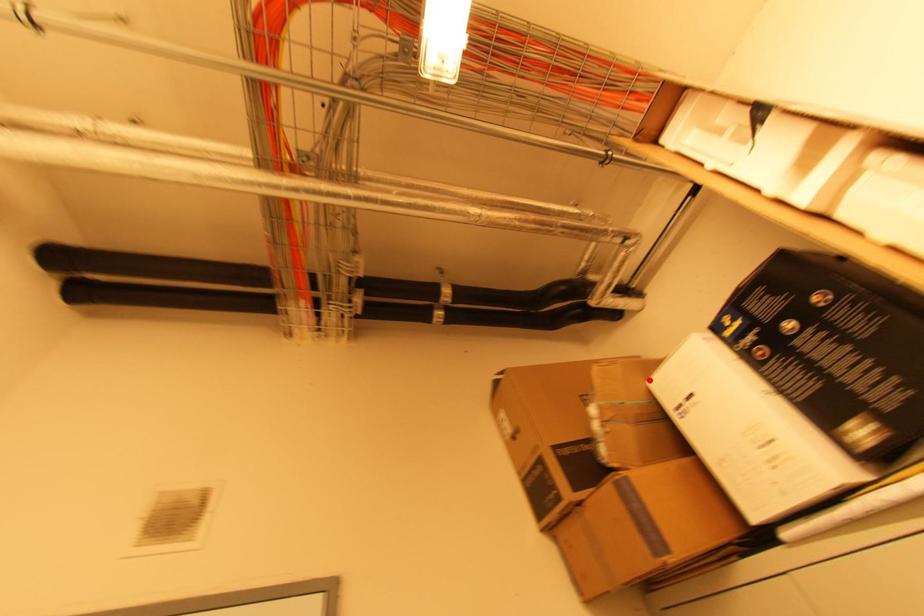
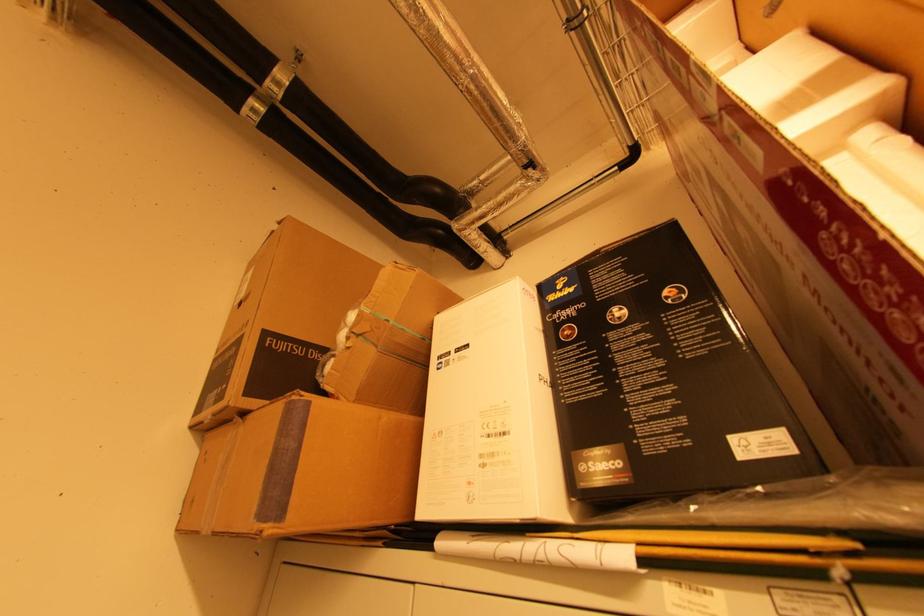
Where in the second image is the point corresponding to the highlighted location from the first image?

(441, 313)